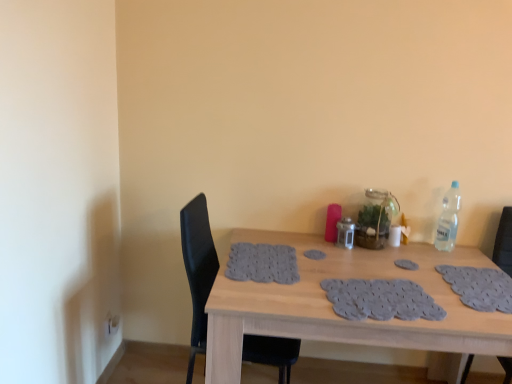
What is the approximate width of black leather chair at left, which is the second chair in right-to-left order?

It is 21.22 inches.

Locate an element on the screen. This screenshot has height=384, width=512. clear plastic bottle at upper right is located at coordinates (448, 219).

Locate an element on the screen. black leather chair at right, which is counted as the 2th chair, starting from the left is located at coordinates (504, 242).

What is the approximate width of gray fabric placemat at center, positioned as the first footprint in right-to-left order?

gray fabric placemat at center, positioned as the first footprint in right-to-left order, is 3.96 inches in width.

How much space does gray fabric footprint at center, marked as the 2th footprint in a right-to-left arrangement, occupy vertically?

0.48 inches.

Describe the element at coordinates (344, 319) in the screenshot. I see `wooden table at center` at that location.

What are the coordinates of `black leather chair at left, which is counted as the first chair, starting from the left` in the screenshot? It's located at (198, 270).

Considering the relative sizes of gray fabric placemat at center, the second footprint viewed from the top, and clear plastic bottle at upper right in the image provided, is gray fabric placemat at center, the second footprint viewed from the top, taller than clear plastic bottle at upper right?

No, gray fabric placemat at center, the second footprint viewed from the top, is not taller than clear plastic bottle at upper right.

From a real-world perspective, relative to clear plastic bottle at upper right, is gray fabric placemat at center, positioned as the first footprint in right-to-left order, vertically above or below?

gray fabric placemat at center, positioned as the first footprint in right-to-left order, is below clear plastic bottle at upper right.

From the image's perspective, is gray fabric placemat at center, placed as the first footprint when sorted from bottom to top, under clear plastic bottle at upper right?

Yes, from the image's perspective, gray fabric placemat at center, placed as the first footprint when sorted from bottom to top, is below clear plastic bottle at upper right.

How distant is gray fabric placemat at center, placed as the second footprint when sorted from left to right, from clear plastic bottle at upper right?

gray fabric placemat at center, placed as the second footprint when sorted from left to right, and clear plastic bottle at upper right are 36.72 centimeters apart from each other.

Which object is positioned more to the left, gray fabric placemat at center, the second footprint viewed from the top, or wooden table at center?

From the viewer's perspective, wooden table at center appears more on the left side.

Considering the relative sizes of gray fabric placemat at center, placed as the second footprint when sorted from left to right, and wooden table at center in the image provided, is gray fabric placemat at center, placed as the second footprint when sorted from left to right, wider than wooden table at center?

Incorrect, the width of gray fabric placemat at center, placed as the second footprint when sorted from left to right, does not surpass that of wooden table at center.

Is gray fabric placemat at center, placed as the first footprint when sorted from bottom to top, turned away from wooden table at center?

Yes, gray fabric placemat at center, placed as the first footprint when sorted from bottom to top, is facing away from wooden table at center.

Based on the photo, relative to wooden table at center, is gray fabric placemat at center, placed as the first footprint when sorted from bottom to top, in front or behind?

gray fabric placemat at center, placed as the first footprint when sorted from bottom to top, is positioned farther from the viewer than wooden table at center.

Can you tell me how much clear plastic bottle at upper right and gray fabric footprint at center, which ranks as the 1th footprint in top-to-bottom order, differ in facing direction?

The angle between the facing direction of clear plastic bottle at upper right and the facing direction of gray fabric footprint at center, which ranks as the 1th footprint in top-to-bottom order, is 1.28 degrees.

Who is more distant, clear plastic bottle at upper right or gray fabric footprint at center, marked as the 2th footprint in a right-to-left arrangement?

clear plastic bottle at upper right is further away from the camera.

Is clear plastic bottle at upper right surrounding gray fabric footprint at center, placed as the 1th footprint when sorted from left to right?

No.

Considering the relative sizes of clear plastic bottle at upper right and gray fabric footprint at center, placed as the 1th footprint when sorted from left to right, in the image provided, is clear plastic bottle at upper right bigger than gray fabric footprint at center, placed as the 1th footprint when sorted from left to right,?

Yes.

Which object is closer to the camera, clear plastic bottle at upper right or gray fabric placemat at center, positioned as the first footprint in right-to-left order?

→ gray fabric placemat at center, positioned as the first footprint in right-to-left order.

From a real-world perspective, is clear plastic bottle at upper right positioned under gray fabric placemat at center, the second footprint viewed from the top, based on gravity?

No, from a real-world perspective, clear plastic bottle at upper right is not beneath gray fabric placemat at center, the second footprint viewed from the top.

Based on their sizes in the image, would you say clear plastic bottle at upper right is bigger or smaller than gray fabric placemat at center, positioned as the first footprint in right-to-left order?

In the image, clear plastic bottle at upper right appears to be larger than gray fabric placemat at center, positioned as the first footprint in right-to-left order.

From the wooden table at center, count 2nd footprints backward and point to it. Please provide its 2D coordinates.

[(314, 254)]

Is point (393, 248) positioned behind point (324, 253)?

That is True.

Considering the sizes of objects wooden table at center and gray fabric footprint at center, placed as the 1th footprint when sorted from left to right, in the image provided, who is bigger, wooden table at center or gray fabric footprint at center, placed as the 1th footprint when sorted from left to right,?

wooden table at center.

Considering the relative sizes of wooden table at center and gray fabric footprint at center, marked as the 2th footprint in a right-to-left arrangement, in the image provided, is wooden table at center thinner than gray fabric footprint at center, marked as the 2th footprint in a right-to-left arrangement,?

No.

Considering the positions of objects gray fabric footprint at center, placed as the 2th footprint when sorted from bottom to top, and black leather chair at right, which is the first chair in right-to-left order, in the image provided, who is in front, gray fabric footprint at center, placed as the 2th footprint when sorted from bottom to top, or black leather chair at right, which is the first chair in right-to-left order,?

Positioned in front is black leather chair at right, which is the first chair in right-to-left order.

From the image's perspective, count 2nd chairs downward from the gray fabric footprint at center, placed as the 2th footprint when sorted from bottom to top, and point to it. Please provide its 2D coordinates.

[(504, 242)]

Which of these two, gray fabric footprint at center, placed as the 1th footprint when sorted from left to right, or black leather chair at right, which is the first chair in right-to-left order, is wider?

Wider between the two is black leather chair at right, which is the first chair in right-to-left order.

Choose the correct answer: Is gray fabric footprint at center, placed as the 1th footprint when sorted from left to right, inside black leather chair at right, which is counted as the 2th chair, starting from the left, or outside it?

gray fabric footprint at center, placed as the 1th footprint when sorted from left to right, is spatially situated outside black leather chair at right, which is counted as the 2th chair, starting from the left.

Which object is thinner, black leather chair at left, which is the second chair in right-to-left order, or clear plastic bottle at upper right?

clear plastic bottle at upper right is thinner.

Is clear plastic bottle at upper right inside black leather chair at left, which is counted as the first chair, starting from the left?

Actually, clear plastic bottle at upper right is outside black leather chair at left, which is counted as the first chair, starting from the left.

Considering the sizes of objects black leather chair at left, which is the second chair in right-to-left order, and clear plastic bottle at upper right in the image provided, who is shorter, black leather chair at left, which is the second chair in right-to-left order, or clear plastic bottle at upper right?

Standing shorter between the two is clear plastic bottle at upper right.

Is black leather chair at left, which is the second chair in right-to-left order, facing away from clear plastic bottle at upper right?

No, black leather chair at left, which is the second chair in right-to-left order, is not facing away from clear plastic bottle at upper right.

Image resolution: width=512 pixels, height=384 pixels. There is a clear plastic bottle at upper right. Identify the location of the 1st footprint below it (from a real-world perspective). (406, 264).

There is a wooden table at center. Identify the location of the 2nd footprint above it (from a real-world perspective). (406, 264).

Estimate the real-world distances between objects in this image. Which object is further from gray fabric footprint at center, which ranks as the 1th footprint in top-to-bottom order, wooden table at center or gray fabric placemat at center, the second footprint viewed from the top?

wooden table at center.

Looking at the image, which one is located further to black leather chair at left, which is the second chair in right-to-left order, gray fabric footprint at center, marked as the 2th footprint in a right-to-left arrangement, or gray fabric placemat at center, placed as the second footprint when sorted from left to right?

gray fabric placemat at center, placed as the second footprint when sorted from left to right, is positioned further to the anchor black leather chair at left, which is the second chair in right-to-left order.

Which object lies further to the anchor point wooden table at center, black leather chair at left, which is counted as the first chair, starting from the left, or black leather chair at right, which is the first chair in right-to-left order?

black leather chair at right, which is the first chair in right-to-left order, lies further to wooden table at center than the other object.

Based on their spatial positions, is black leather chair at right, which is counted as the 2th chair, starting from the left, or gray fabric placemat at center, positioned as the first footprint in right-to-left order, closer to wooden table at center?

gray fabric placemat at center, positioned as the first footprint in right-to-left order.

Considering their positions, is gray fabric footprint at center, which ranks as the 1th footprint in top-to-bottom order, positioned further to clear plastic bottle at upper right than black leather chair at right, which is counted as the 2th chair, starting from the left?

Among the two, gray fabric footprint at center, which ranks as the 1th footprint in top-to-bottom order, is located further to clear plastic bottle at upper right.

Which object lies nearer to the anchor point gray fabric placemat at center, the second footprint viewed from the top, black leather chair at right, which is the first chair in right-to-left order, or gray fabric footprint at center, placed as the 1th footprint when sorted from left to right?

Among the two, gray fabric footprint at center, placed as the 1th footprint when sorted from left to right, is located nearer to gray fabric placemat at center, the second footprint viewed from the top.

Looking at this image, which object lies nearer to the anchor point black leather chair at right, which is the first chair in right-to-left order, gray fabric footprint at center, which ranks as the 1th footprint in top-to-bottom order, or wooden table at center?

Based on the image, wooden table at center appears to be nearer to black leather chair at right, which is the first chair in right-to-left order.

When comparing their distances from black leather chair at left, which is counted as the first chair, starting from the left, does gray fabric placemat at center, the second footprint viewed from the top, or gray fabric footprint at center, placed as the 2th footprint when sorted from bottom to top, seem further?

Among the two, gray fabric placemat at center, the second footprint viewed from the top, is located further to black leather chair at left, which is counted as the first chair, starting from the left.

Where is `table located between gray fabric footprint at center, placed as the 1th footprint when sorted from left to right, and black leather chair at right, which is counted as the 2th chair, starting from the left, in the left-right direction`? The height and width of the screenshot is (384, 512). table located between gray fabric footprint at center, placed as the 1th footprint when sorted from left to right, and black leather chair at right, which is counted as the 2th chair, starting from the left, in the left-right direction is located at coordinates (344, 319).

Locate an element on the screen. The image size is (512, 384). footprint situated between gray fabric footprint at center, which ranks as the 1th footprint in top-to-bottom order, and clear plastic bottle at upper right from left to right is located at coordinates (406, 264).

Image resolution: width=512 pixels, height=384 pixels. I want to click on footprint between wooden table at center and black leather chair at right, which is the first chair in right-to-left order, in the horizontal direction, so click(406, 264).

This screenshot has height=384, width=512. I want to click on table between black leather chair at left, which is the second chair in right-to-left order, and clear plastic bottle at upper right, in the horizontal direction, so click(344, 319).